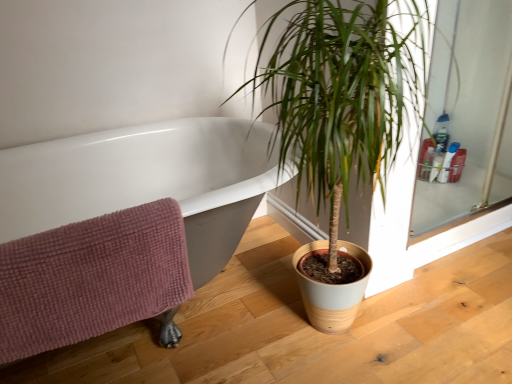
Identify the location of free space to the left of translucent plastic bottles at upper right, the 2th toiletry in the right-to-left sequence. The height and width of the screenshot is (384, 512). (431, 193).